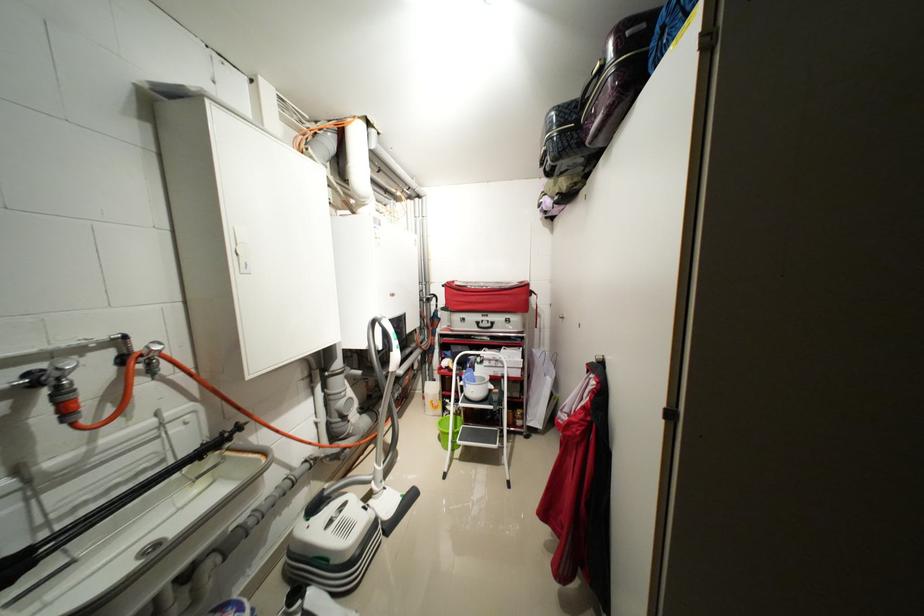
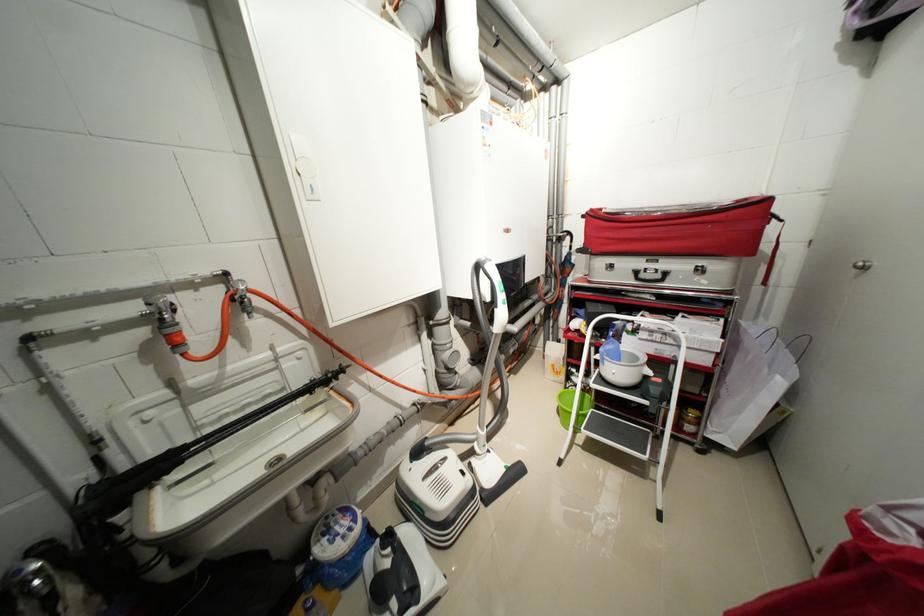
Question: I am providing you with two images of the same scene from different viewpoints. Which of the following objects are not visible in image2?

Choices:
 (A) green bucket
 (B) silver valve knob
 (C) white cabinet handle
 (D) none of these

Answer: (D)